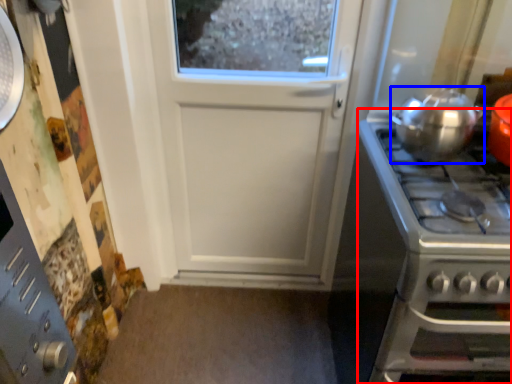
Question: Among these objects, which one is farthest to the camera, gas stove (highlighted by a red box) or kitchen appliance (highlighted by a blue box)?

Choices:
 (A) gas stove
 (B) kitchen appliance

Answer: (B)